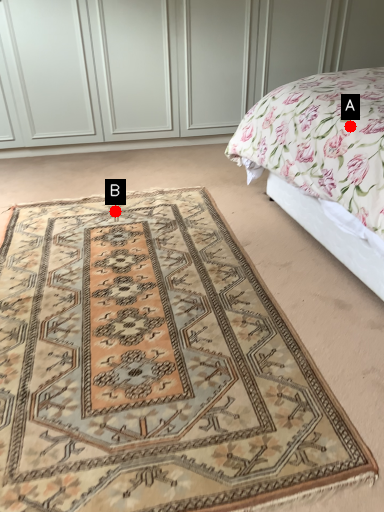
Question: Two points are circled on the image, labeled by A and B beside each circle. Among these points, which one is nearest to the camera?

Choices:
 (A) A is closer
 (B) B is closer

Answer: (A)